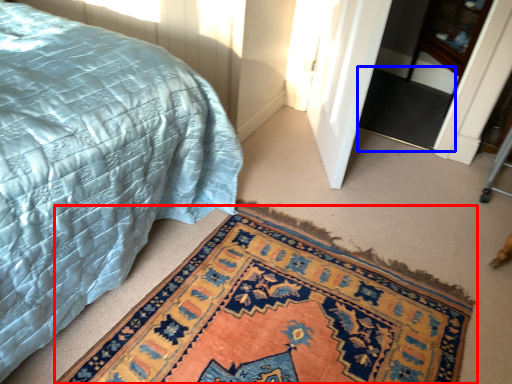
Question: Which object is closer to the camera taking this photo, mat (highlighted by a red box) or doormat (highlighted by a blue box)?

Choices:
 (A) mat
 (B) doormat

Answer: (A)